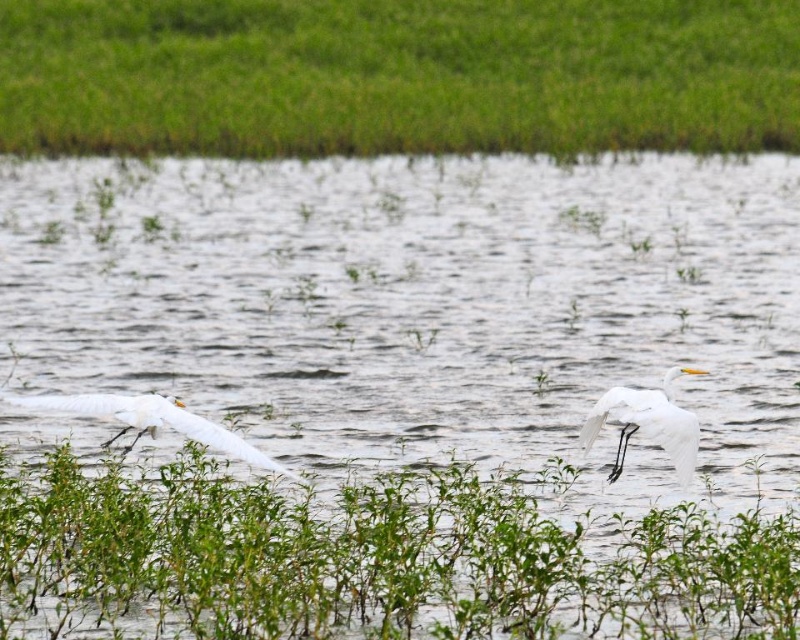
Question: Can you confirm if green grass at upper center is positioned to the right of white matte bird at center?

Choices:
 (A) no
 (B) yes

Answer: (A)

Question: Observing the image, what is the correct spatial positioning of green leafy plants at lower center in reference to white feathered bird at left?

Choices:
 (A) right
 (B) left

Answer: (A)

Question: Among these points, which one is farthest from the camera?

Choices:
 (A) (208, 540)
 (B) (672, 403)
 (C) (66, 52)
 (D) (230, 442)

Answer: (C)

Question: Which object is farther from the camera taking this photo?

Choices:
 (A) green leafy plants at lower center
 (B) white feathered bird at left
 (C) green grass at upper center
 (D) white matte bird at center

Answer: (C)

Question: Which of the following is the farthest from the observer?

Choices:
 (A) (586, 449)
 (B) (512, 579)
 (C) (132, 104)

Answer: (C)

Question: Can you confirm if white feathered bird at left is positioned to the right of white matte bird at center?

Choices:
 (A) no
 (B) yes

Answer: (A)